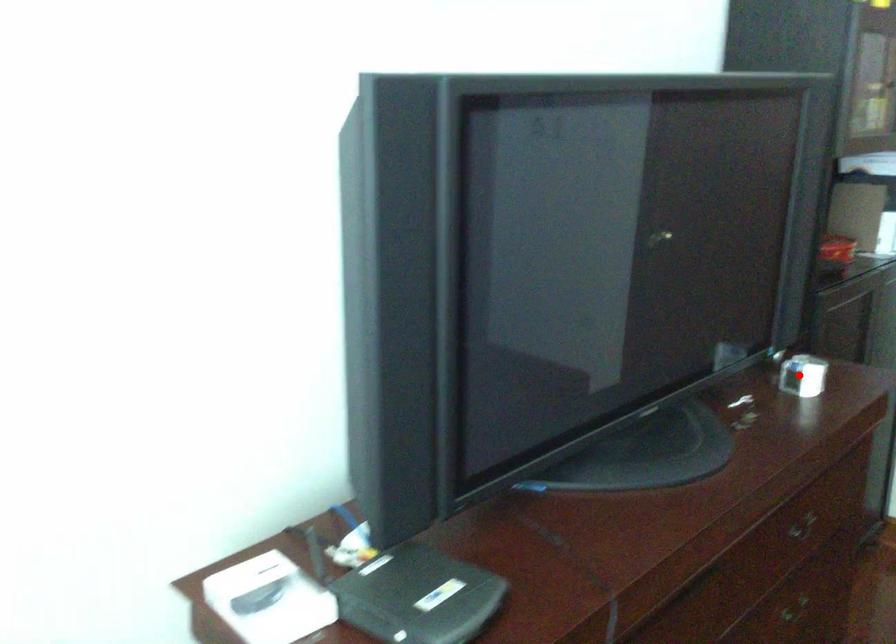
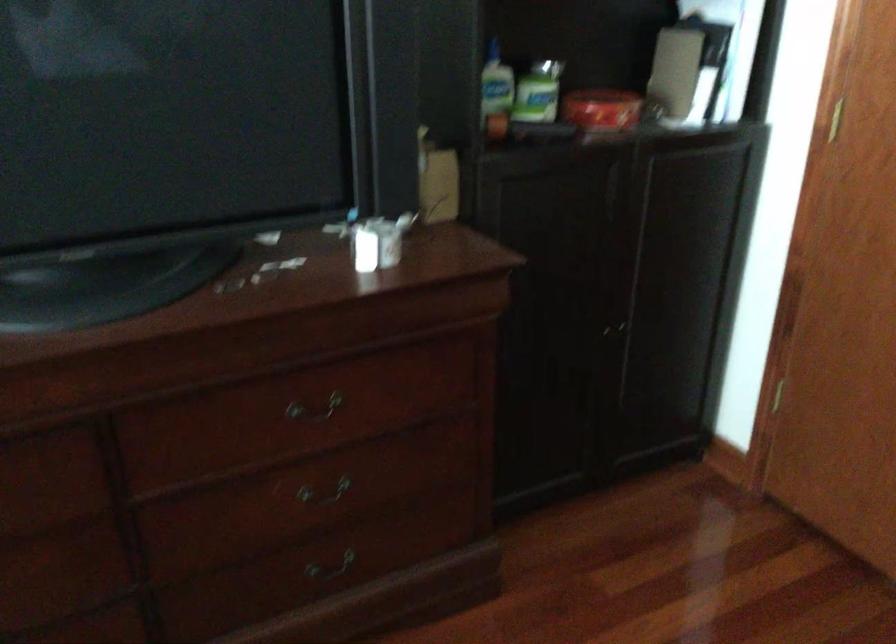
Question: I am providing you with two images of the same scene from different viewpoints. Image1 has a red point marked. In image2, the corresponding 3D location appears at what relative position? Reply with the corresponding letter.

Choices:
 (A) Closer
 (B) Farther

Answer: (A)